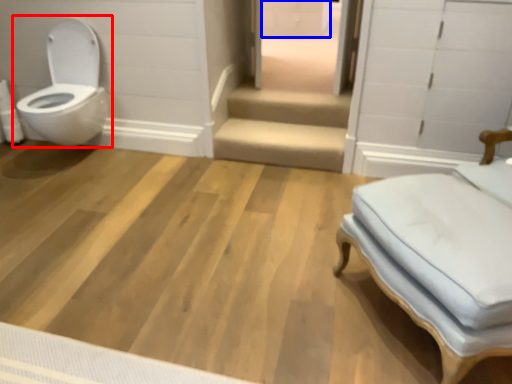
Question: Which of the following is the farthest to the observer, toilet (highlighted by a red box) or drawer (highlighted by a blue box)?

Choices:
 (A) toilet
 (B) drawer

Answer: (B)